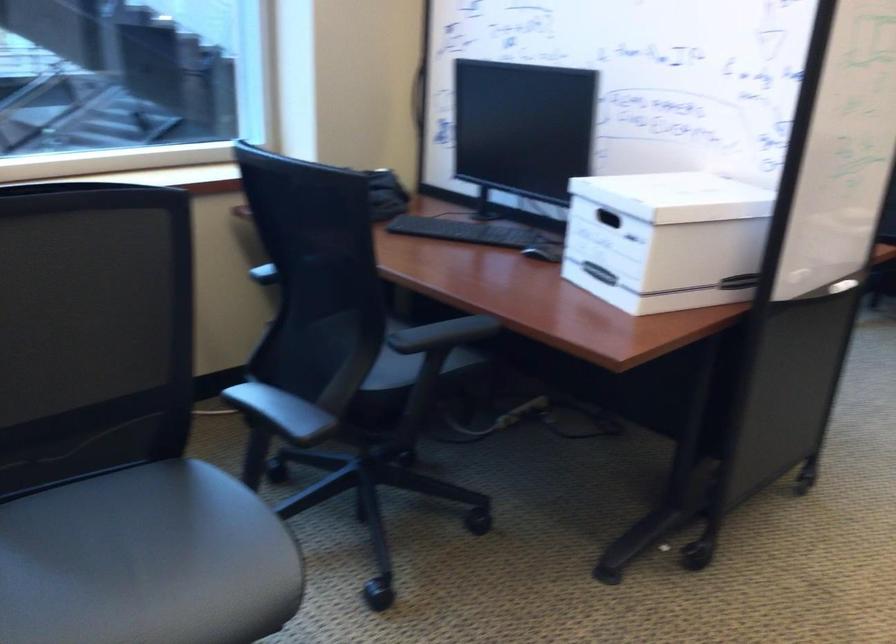
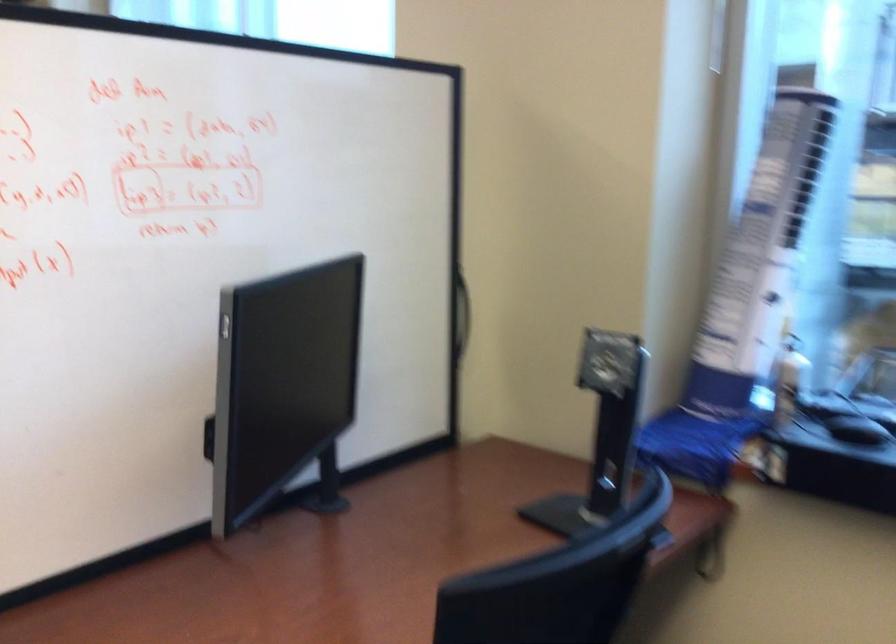
The point at (388, 105) is marked in the first image. Where is the corresponding point in the second image?

(461, 313)